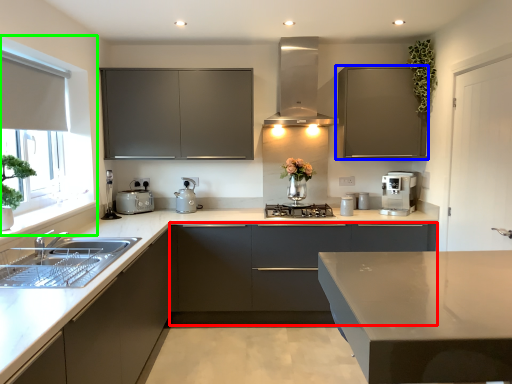
Question: Based on their relative distances, which object is nearer to cabinetry (highlighted by a red box)? Choose from cabinetry (highlighted by a blue box) and window screen (highlighted by a green box).

Choices:
 (A) cabinetry
 (B) window screen

Answer: (A)